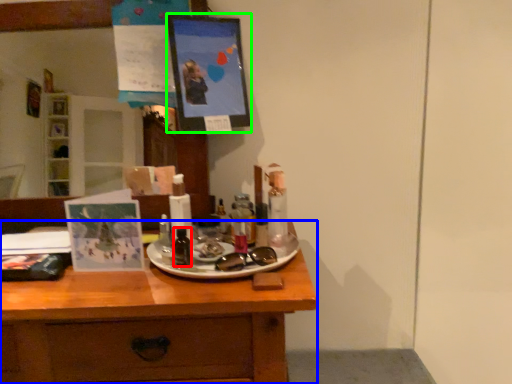
Question: Which object is the farthest from toiletry (highlighted by a red box)? Choose among these: desk (highlighted by a blue box) or picture frame (highlighted by a green box).

Choices:
 (A) desk
 (B) picture frame

Answer: (B)